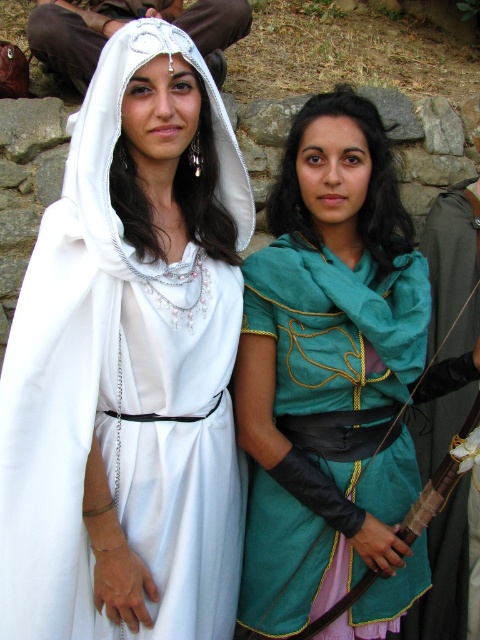
You are standing in front of the two costumed individuals. You notice two points marked on the image. One is at position point (327, 113) and the other at point (67, 12). Which point is nearer to you?

Point (327, 113) is closer to the viewer than point (67, 12).

You are a costume designer observing the two characters in the medieval fantasy scene. You need to determine which costume requires a taller model to look proportional. Based on the description of the matte white dress at center and the teal satin tunic at center, which one would you choose?

The teal satin tunic at center is taller than the matte white dress at center, so the teal satin tunic at center would require a taller model to look proportional.

You are a costume designer preparing for a play. You need to decide which costume element takes up more horizontal space. Based on the scene description, which one is wider between the teal fabric dress at center and the white satin headdress at upper center?

The teal fabric dress at center has a lesser width compared to the white satin headdress at upper center, so the white satin headdress at upper center is wider.